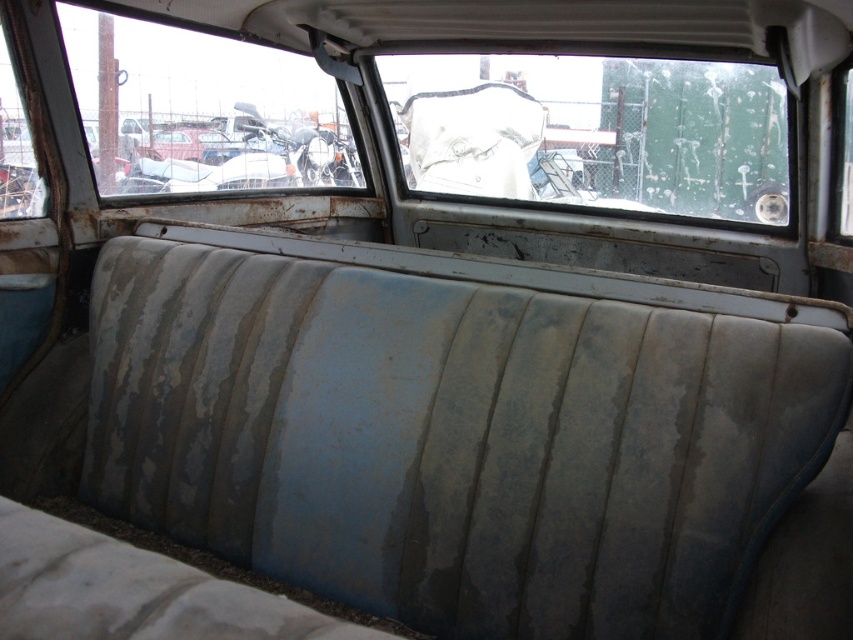
Question: Is frosted glass windshield at upper center in front of transparent glass window at upper left?

Choices:
 (A) yes
 (B) no

Answer: (B)

Question: Does frosted glass windshield at upper center have a lesser width compared to transparent glass window at upper left?

Choices:
 (A) yes
 (B) no

Answer: (B)

Question: Which of the following is the closest to the observer?

Choices:
 (A) (727, 200)
 (B) (329, 141)

Answer: (B)

Question: From the image, what is the correct spatial relationship of frosted glass windshield at upper center in relation to transparent glass window at upper left?

Choices:
 (A) right
 (B) left

Answer: (A)

Question: Among these objects, which one is farthest from the camera?

Choices:
 (A) transparent glass window at upper left
 (B) frosted glass windshield at upper center

Answer: (B)